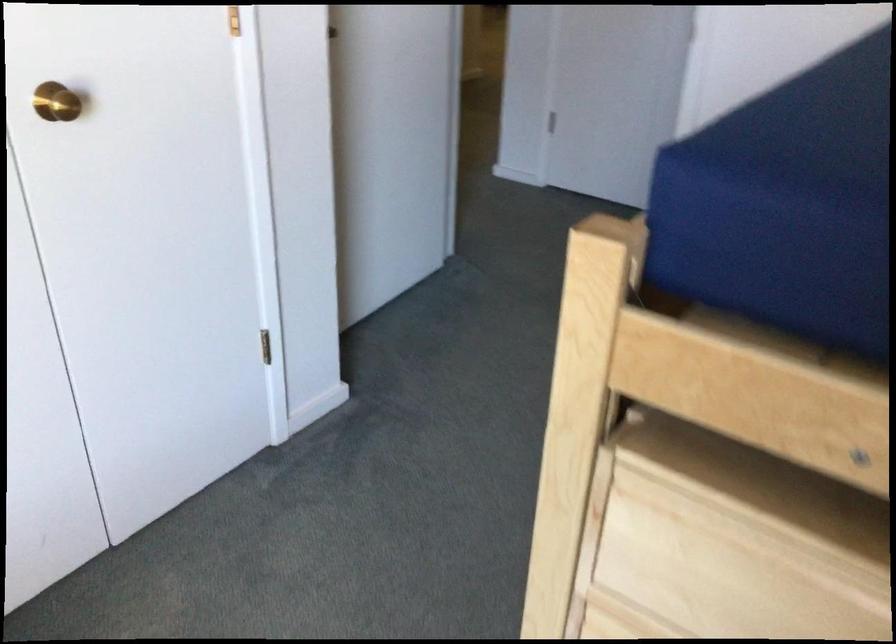
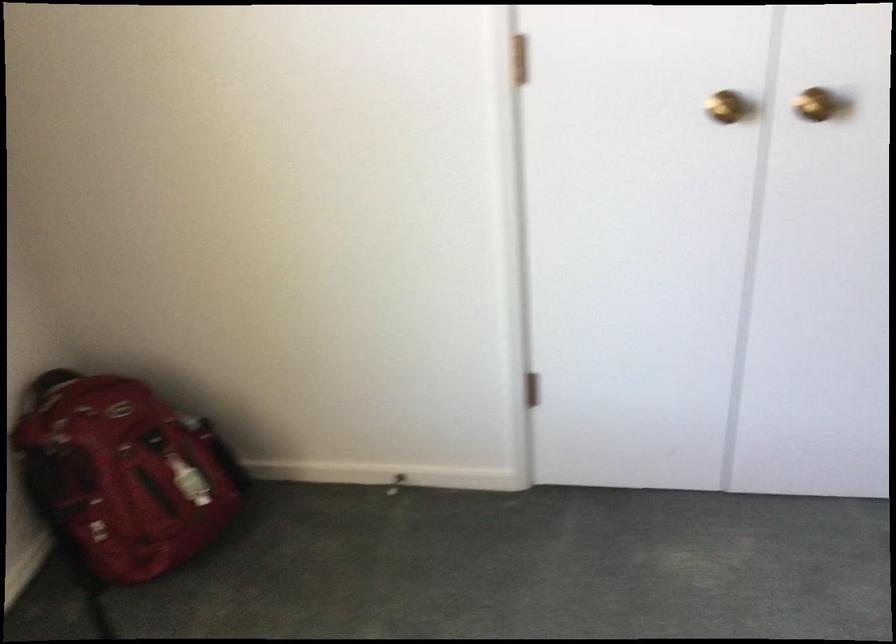
Question: Based on the continuous images, in which direction is the camera rotating? Reply with the corresponding letter.

Choices:
 (A) Left
 (B) Right
 (C) Up
 (D) Down

Answer: (A)